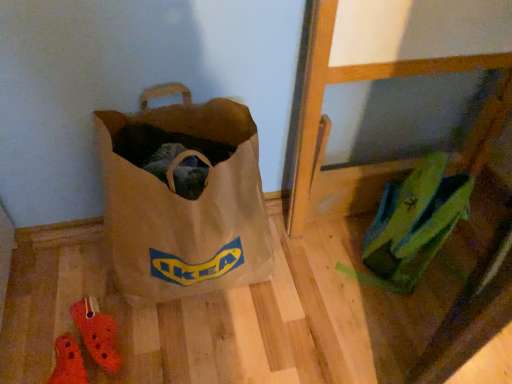
At what (x,y) coordinates should I click in order to perform the action: click on free space that is in between brown canvas bag at lower left and green fabric backpack at upper right. Please return your answer as a coordinate pair (x, y). This screenshot has height=384, width=512. Looking at the image, I should click on (313, 269).